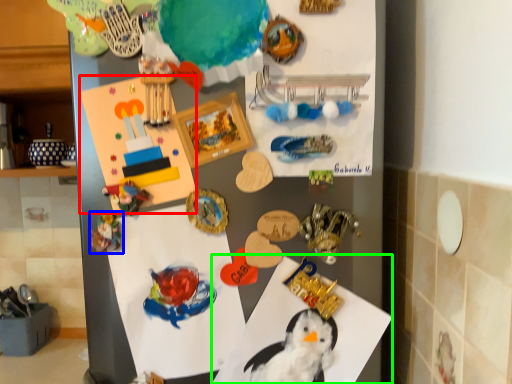
Question: Which object is positioned farthest from postcard (highlighted by a red box)? Select from art (highlighted by a blue box) and paper (highlighted by a green box).

Choices:
 (A) art
 (B) paper

Answer: (B)